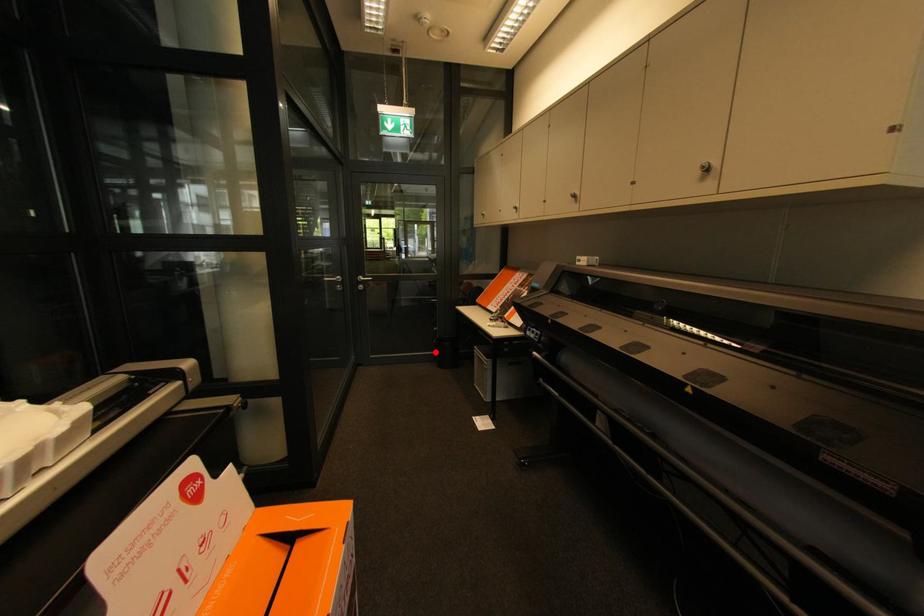
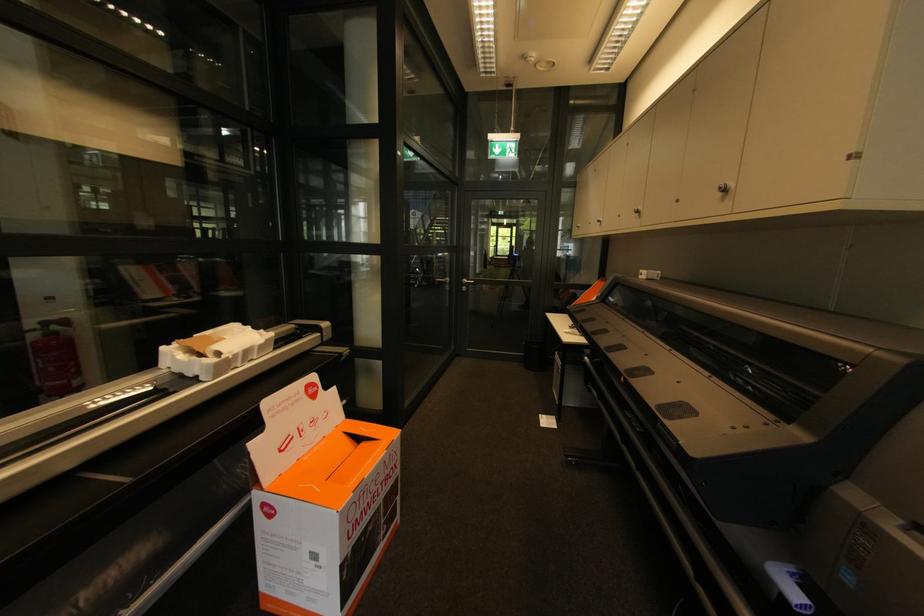
Find the pixel in the second image that matches the highlighted location in the first image.

(526, 354)